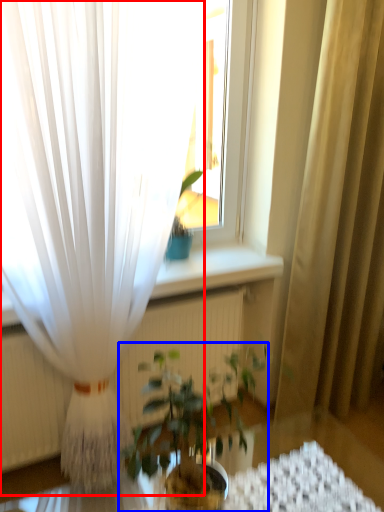
Question: Among these objects, which one is farthest to the camera, curtain (highlighted by a red box) or houseplant (highlighted by a blue box)?

Choices:
 (A) curtain
 (B) houseplant

Answer: (A)